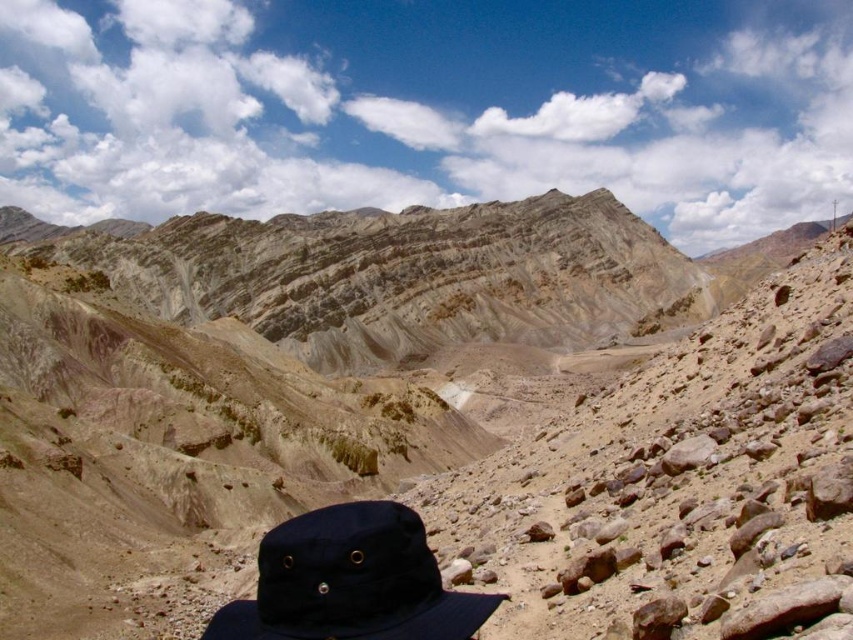
Where is `matte brown rock at center`? The width and height of the screenshot is (853, 640). matte brown rock at center is located at coordinates (416, 464).

Between point (97, 492) and point (368, 609), which one is positioned behind?

The point (97, 492) is more distant.

This screenshot has height=640, width=853. What are the coordinates of `matte brown rock at center` in the screenshot? It's located at (416, 464).